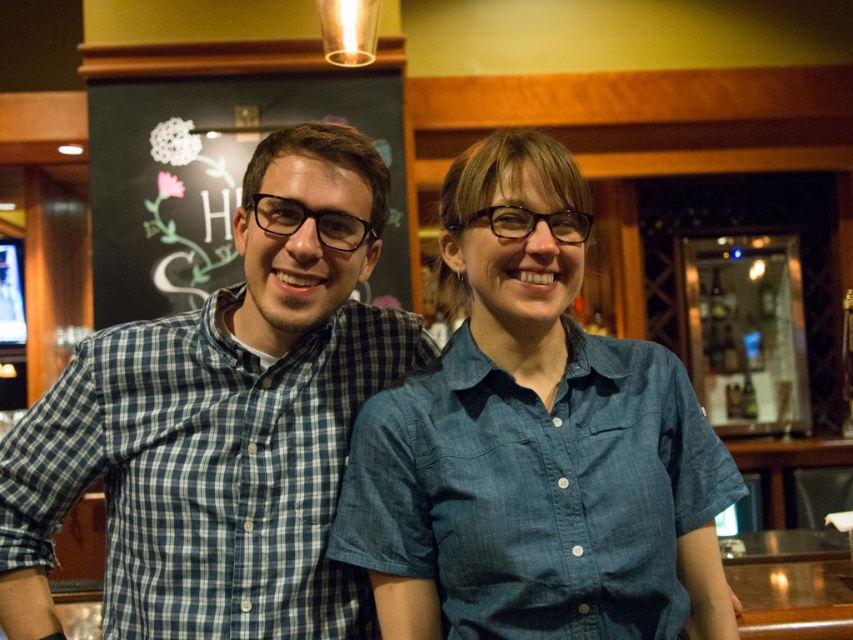
Question: Observing the image, what is the correct spatial positioning of denim shirt at center in reference to blue checkered shirt at left?

Choices:
 (A) right
 (B) left

Answer: (A)

Question: Which of the following is the closest to the observer?

Choices:
 (A) (236, 166)
 (B) (247, 288)

Answer: (B)

Question: Among these points, which one is nearest to the camera?

Choices:
 (A) 209,234
 (B) 424,422

Answer: (B)

Question: Which of the following is the farthest from the observer?

Choices:
 (A) (399, 252)
 (B) (296, 540)

Answer: (A)

Question: Is denim shirt at center smaller than blue checkered shirt at left?

Choices:
 (A) no
 (B) yes

Answer: (A)

Question: Is denim shirt at center to the left of blue checkered shirt at left from the viewer's perspective?

Choices:
 (A) yes
 (B) no

Answer: (B)